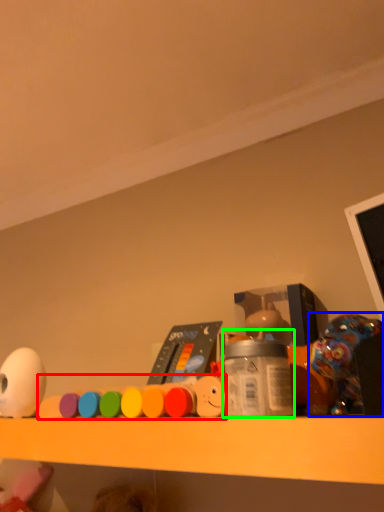
Question: Which object is positioned farthest from toy (highlighted by a red box)? Select from toy (highlighted by a blue box) and bottle (highlighted by a green box).

Choices:
 (A) toy
 (B) bottle

Answer: (A)